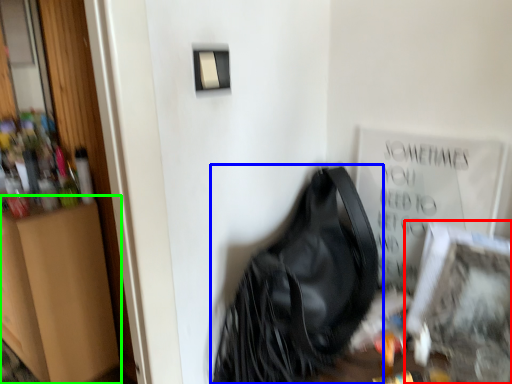
Question: Estimate the real-world distances between objects in this image. Which object is farther from picture frame (highlighted by a red box), handbag (highlighted by a blue box) or dresser (highlighted by a green box)?

Choices:
 (A) handbag
 (B) dresser

Answer: (B)